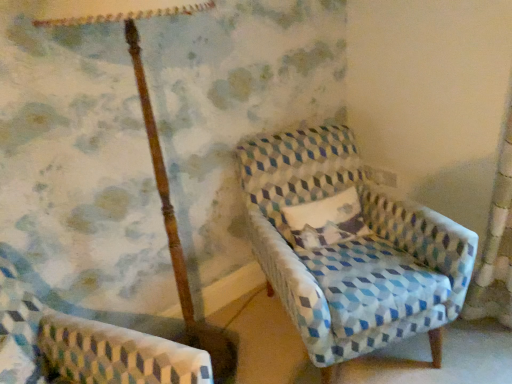
Question: Can you confirm if patterned fabric armchair at lower left, marked as the second chair in a right-to-left arrangement, is positioned to the right of wooden pole at upper left?

Choices:
 (A) yes
 (B) no

Answer: (B)

Question: Is patterned fabric armchair at lower left, marked as the second chair in a right-to-left arrangement, turned away from wooden pole at upper left?

Choices:
 (A) yes
 (B) no

Answer: (B)

Question: Does patterned fabric armchair at lower left, which appears as the first chair when viewed from the left, lie in front of wooden pole at upper left?

Choices:
 (A) yes
 (B) no

Answer: (A)

Question: Could you tell me if patterned fabric armchair at lower left, which appears as the first chair when viewed from the left, is turned towards wooden pole at upper left?

Choices:
 (A) no
 (B) yes

Answer: (A)

Question: Is patterned fabric armchair at lower left, marked as the second chair in a right-to-left arrangement, further to the viewer compared to wooden pole at upper left?

Choices:
 (A) no
 (B) yes

Answer: (A)

Question: Considering the positions of wooden pole at upper left and patterned fabric armchair at lower left, which appears as the first chair when viewed from the left, in the image, is wooden pole at upper left bigger or smaller than patterned fabric armchair at lower left, which appears as the first chair when viewed from the left,?

Choices:
 (A) small
 (B) big

Answer: (B)

Question: Considering the positions of point (176, 281) and point (15, 284), is point (176, 281) closer or farther from the camera than point (15, 284)?

Choices:
 (A) closer
 (B) farther

Answer: (B)

Question: From the image's perspective, is wooden pole at upper left positioned above or below patterned fabric armchair at lower left, marked as the second chair in a right-to-left arrangement?

Choices:
 (A) below
 (B) above

Answer: (B)

Question: Is wooden pole at upper left wider or thinner than patterned fabric armchair at lower left, marked as the second chair in a right-to-left arrangement?

Choices:
 (A) thin
 (B) wide

Answer: (A)

Question: Considering the positions of textured cream pillow at center and patterned fabric armchair at lower left, which appears as the first chair when viewed from the left, in the image, is textured cream pillow at center bigger or smaller than patterned fabric armchair at lower left, which appears as the first chair when viewed from the left,?

Choices:
 (A) small
 (B) big

Answer: (A)

Question: From the image's perspective, is textured cream pillow at center located above or below patterned fabric armchair at lower left, marked as the second chair in a right-to-left arrangement?

Choices:
 (A) above
 (B) below

Answer: (A)

Question: Would you say textured cream pillow at center is to the left or to the right of patterned fabric armchair at lower left, marked as the second chair in a right-to-left arrangement, in the picture?

Choices:
 (A) left
 (B) right

Answer: (B)

Question: Considering the positions of textured cream pillow at center and patterned fabric armchair at lower left, marked as the second chair in a right-to-left arrangement, in the image, is textured cream pillow at center taller or shorter than patterned fabric armchair at lower left, marked as the second chair in a right-to-left arrangement,?

Choices:
 (A) short
 (B) tall

Answer: (A)

Question: In terms of width, does textured cream pillow at center look wider or thinner when compared to textured blue and white armchair at center, which is the 1th chair from right to left?

Choices:
 (A) wide
 (B) thin

Answer: (B)

Question: Does point (353, 215) appear closer or farther from the camera than point (395, 316)?

Choices:
 (A) farther
 (B) closer

Answer: (A)